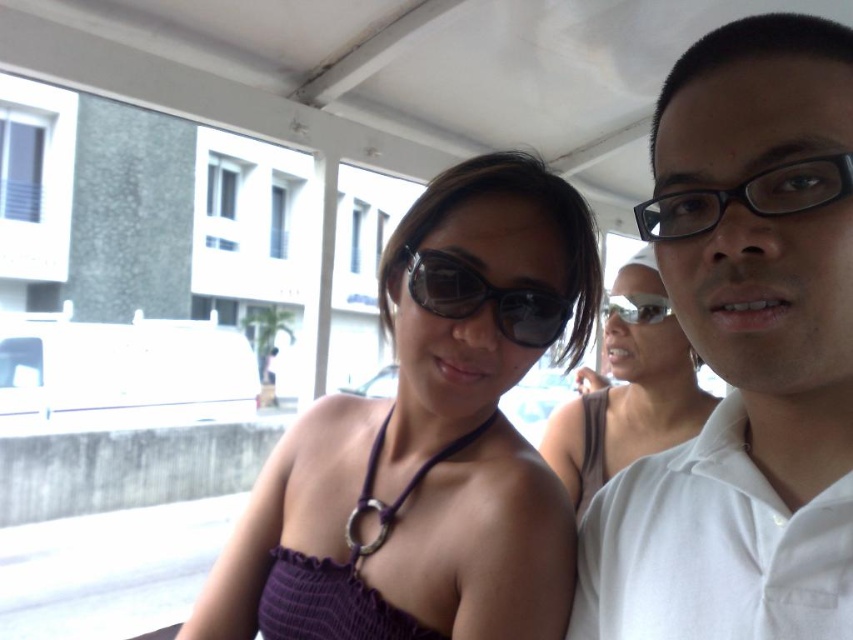
Question: Which object appears closest to the camera in this image?

Choices:
 (A) black plastic glasses at right
 (B) white cotton shirt at center
 (C) matte purple dress at center
 (D) sunglasses at center

Answer: (A)

Question: Which point appears closest to the camera in this image?

Choices:
 (A) (706, 211)
 (B) (662, 248)
 (C) (651, 301)
 (D) (669, 314)

Answer: (A)

Question: Observing the image, what is the correct spatial positioning of purple fabric dress at center in reference to black plastic glasses at right?

Choices:
 (A) below
 (B) above

Answer: (A)

Question: Is purple fabric dress at center smaller than black plastic glasses at right?

Choices:
 (A) no
 (B) yes

Answer: (A)

Question: Which point appears closest to the camera in this image?

Choices:
 (A) (648, 292)
 (B) (647, 401)
 (C) (412, 273)

Answer: (C)

Question: Does matte purple dress at center have a larger size compared to black plastic glasses at right?

Choices:
 (A) yes
 (B) no

Answer: (A)